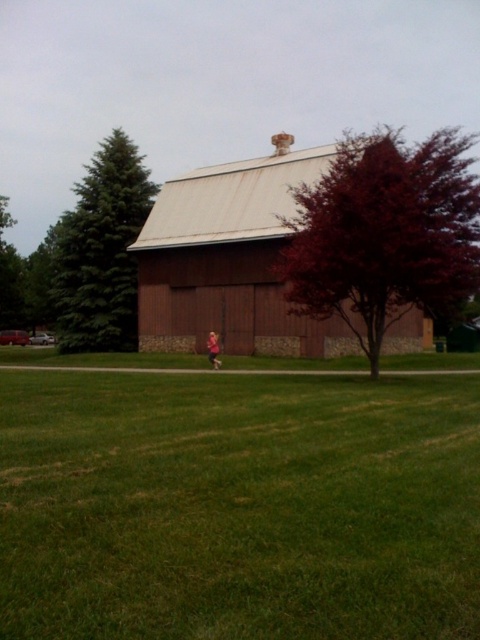
Question: Can you confirm if green grass at center is positioned above green leafy tree at left?

Choices:
 (A) no
 (B) yes

Answer: (A)

Question: Does shiny crimson tree at right have a lesser width compared to brown wooden barn at center?

Choices:
 (A) no
 (B) yes

Answer: (A)

Question: Among these objects, which one is nearest to the camera?

Choices:
 (A) green leafy tree at left
 (B) pink fabric at center
 (C) shiny crimson tree at right
 (D) brown wooden barn at center

Answer: (C)

Question: Can you confirm if brown wooden barn at center is bigger than green leafy tree at left?

Choices:
 (A) no
 (B) yes

Answer: (A)

Question: Which is farther from the green fir tree at left?

Choices:
 (A) brown wooden barn at center
 (B) pink fabric at center

Answer: (B)

Question: Which of the following is the closest to the observer?

Choices:
 (A) pink fabric at center
 (B) shiny crimson tree at right

Answer: (B)